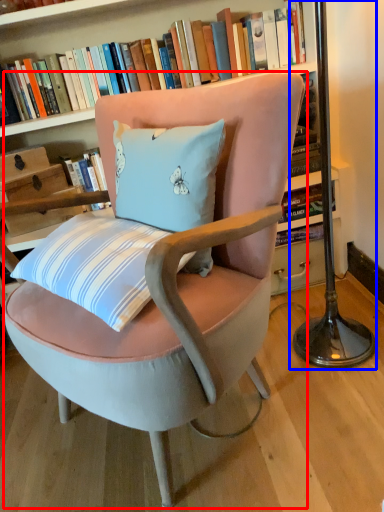
Question: Among these objects, which one is farthest to the camera, chair (highlighted by a red box) or table lamp (highlighted by a blue box)?

Choices:
 (A) chair
 (B) table lamp

Answer: (B)